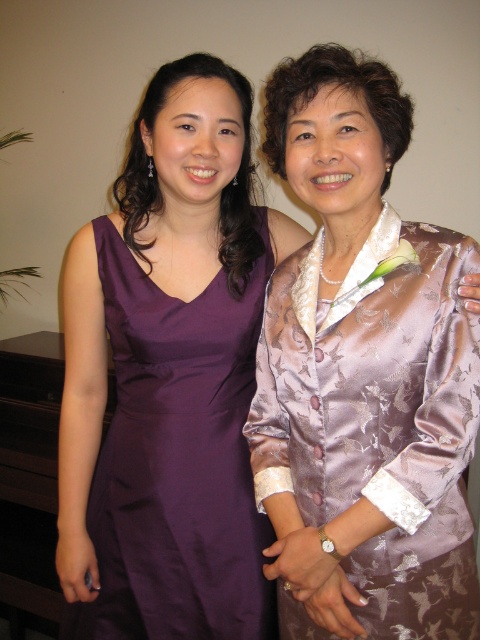
You are taking a photo of two people wearing dresses. You want to focus on the silky purple dress at center and the purple satin dress at left. Which dress is nearer to the camera?

The silky purple dress at center is closer to the viewer than the purple satin dress at left, so it is nearer to the camera.

You are a photographer trying to focus on the silky purple dress at center. Based on its position coordinates, where should you adjust your camera to capture it properly?

The silky purple dress at center is located at coordinates point (x=362, y=374), so adjust your camera to that position to capture it properly.

You are a photographer setting up for a photoshoot. You have two dresses displayed in the scene. The silky purple dress at center and the purple satin dress at left. Which dress is positioned higher in the frame?

The silky purple dress at center is positioned higher in the frame because it is much taller than the purple satin dress at left.